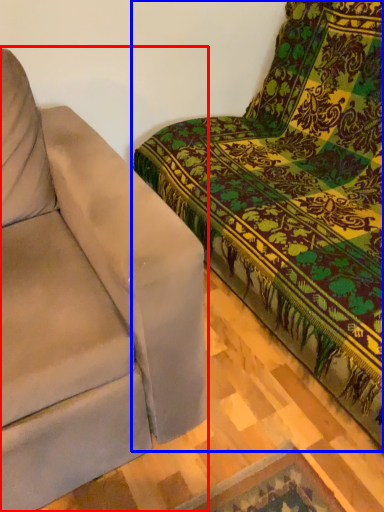
Question: Which object appears closest to the camera in this image, studio couch (highlighted by a red box) or studio couch (highlighted by a blue box)?

Choices:
 (A) studio couch
 (B) studio couch

Answer: (B)